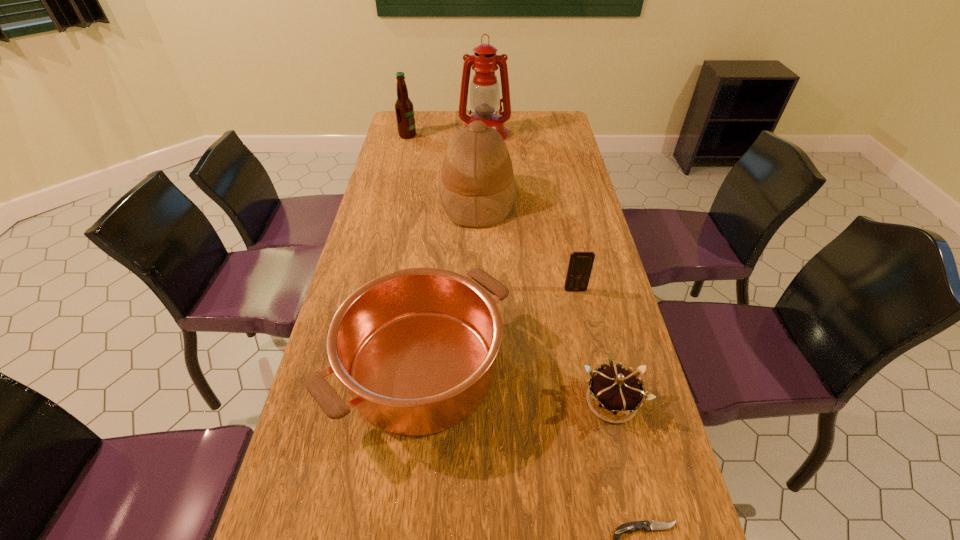
You are a GUI agent. You are given a task and a screenshot of the screen. Output one action in this format:
    pyautogui.click(x=<x>, y=<y>)
    Task: Click on the free region located on the screen of the cellular telephone
    The image size is (960, 540).
    Given the screenshot: What is the action you would take?
    pyautogui.click(x=601, y=414)

Image resolution: width=960 pixels, height=540 pixels. In order to click on vacant space located 0.310m on the left of the second shortest object in this screenshot , I will do `click(441, 401)`.

Find the location of `oil lamp present at the far edge`. oil lamp present at the far edge is located at coordinates (485, 99).

The image size is (960, 540). What are the coordinates of `beer bottle that is positioned at the far edge` in the screenshot? It's located at (404, 110).

In order to click on beer bottle at the left edge in this screenshot , I will do `click(404, 110)`.

You are a GUI agent. You are given a task and a screenshot of the screen. Output one action in this format:
    pyautogui.click(x=<x>, y=<y>)
    Task: Click on the saucepan positioned at the left edge
    
    Given the screenshot: What is the action you would take?
    pyautogui.click(x=415, y=347)

Find the location of a particular element. The image size is (960, 540). cellular telephone at the right edge is located at coordinates (580, 265).

Where is `crown that is positioned at the right edge`? Image resolution: width=960 pixels, height=540 pixels. crown that is positioned at the right edge is located at coordinates (614, 394).

The image size is (960, 540). What are the coordinates of `object present at the far left corner` in the screenshot? It's located at (404, 110).

I want to click on free space at the far edge of the desktop, so 516,136.